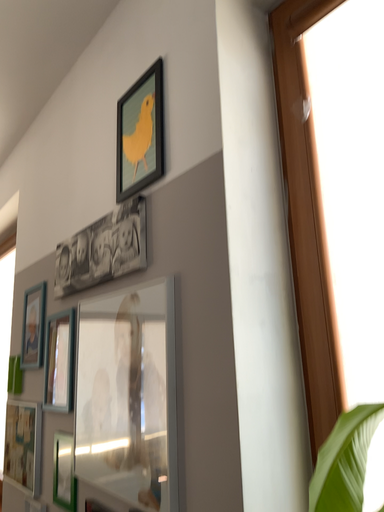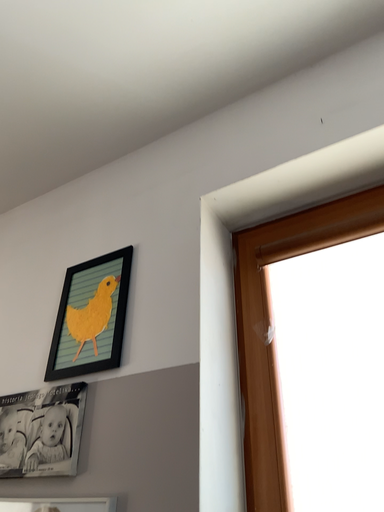
Question: Which way did the camera rotate in the video?

Choices:
 (A) rotated downward
 (B) rotated upward

Answer: (B)